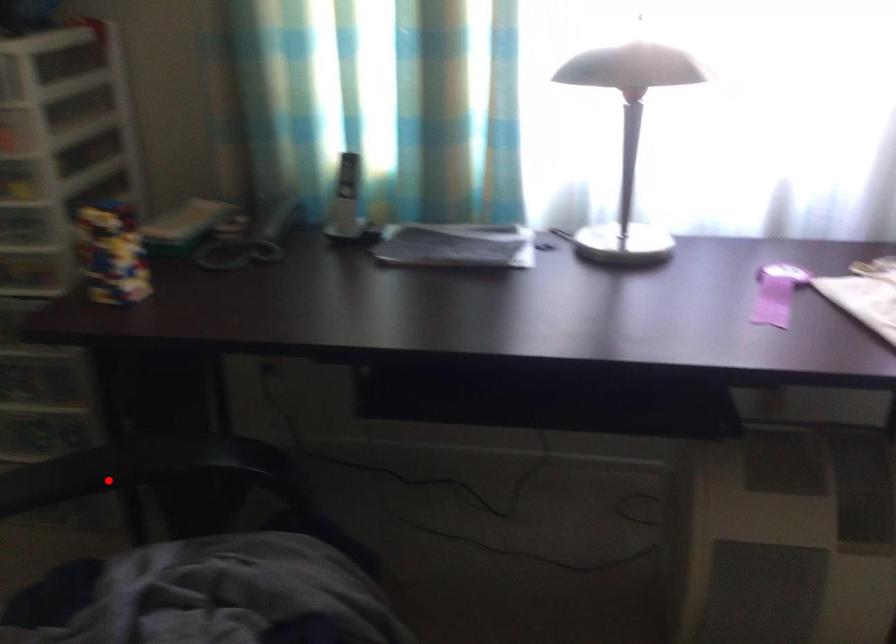
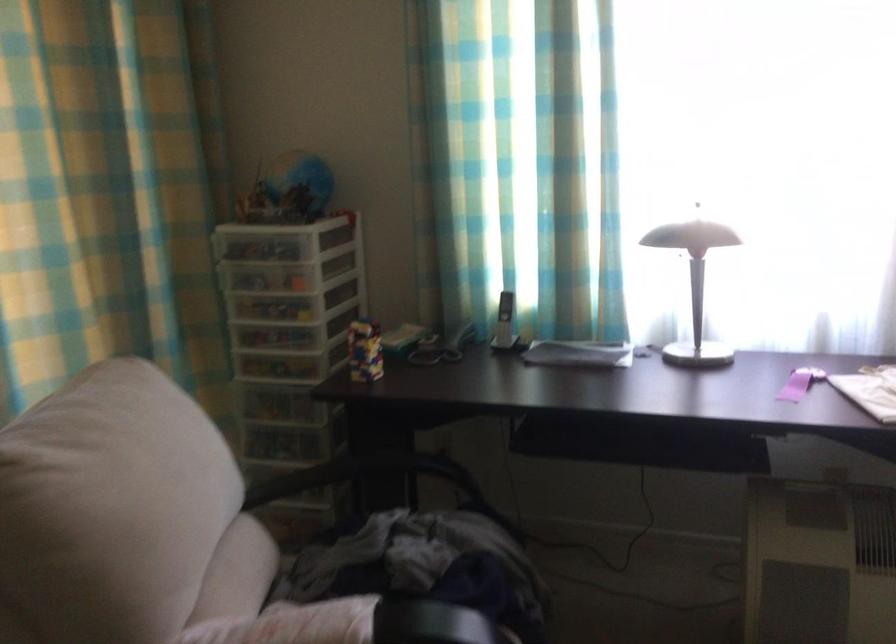
Question: I am providing you with two images of the same scene from different viewpoints. Image1 has a red point marked. In image2, the corresponding 3D location appears at what relative position? Reply with the corresponding letter.

Choices:
 (A) Closer
 (B) Farther

Answer: (B)